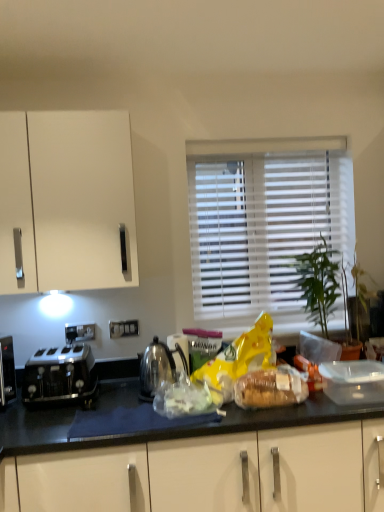
Measure the distance between polished metallic kettle at center and camera.

The depth of polished metallic kettle at center is 5.68 feet.

What is the approximate width of translucent plastic bag at center, positioned as the first food in left-to-right order?

It is 8.03 inches.

What do you see at coordinates (59, 375) in the screenshot? The image size is (384, 512). I see `satin black toaster at left` at bounding box center [59, 375].

Identify the location of translucent plastic bread at center, which appears as the 2th food when viewed from the left. This screenshot has height=512, width=384. (270, 388).

What are the coordinates of `white blinds at center` in the screenshot? It's located at (263, 221).

Where is `polished metallic kettle at center`? polished metallic kettle at center is located at coordinates (158, 367).

Is satin black toaster at left surrounded by translucent plastic bag at center, the 2th food from the right?

Definitely not — satin black toaster at left is not inside translucent plastic bag at center, the 2th food from the right.

How much distance is there between translucent plastic bag at center, the 2th food from the right, and satin black toaster at left?

translucent plastic bag at center, the 2th food from the right, and satin black toaster at left are 16.89 inches apart.

Consider the image. Looking at their sizes, would you say translucent plastic bag at center, positioned as the first food in left-to-right order, is wider or thinner than satin black toaster at left?

translucent plastic bag at center, positioned as the first food in left-to-right order, is thinner than satin black toaster at left.

Can you see translucent plastic bag at center, the 2th food from the right, touching satin black toaster at left?

No, translucent plastic bag at center, the 2th food from the right, is not next to satin black toaster at left.

Is polished metallic kettle at center oriented towards white blinds at center?

No, polished metallic kettle at center is not oriented towards white blinds at center.

In the image, is polished metallic kettle at center positioned in front of or behind white blinds at center?

In the image, polished metallic kettle at center appears in front of white blinds at center.

Is point (170, 355) closer or farther from the camera than point (202, 256)?

Clearly, point (170, 355) is closer to the camera than point (202, 256).

How far apart are polished metallic kettle at center and white blinds at center?

The distance of polished metallic kettle at center from white blinds at center is 29.71 inches.

Is satin black toaster at left further to the viewer compared to white blinds at center?

No.

Is white blinds at center surrounded by satin black toaster at left?

No, satin black toaster at left does not contain white blinds at center.

Is satin black toaster at left oriented away from white blinds at center?

No, satin black toaster at left is not facing away from white blinds at center.

Relative to white blinds at center, is translucent plastic bread at center, which appears as the 2th food when viewed from the left, in front or behind?

Clearly, translucent plastic bread at center, which appears as the 2th food when viewed from the left, is in front of white blinds at center.

Is translucent plastic bread at center, which appears as the 2th food when viewed from the left, bigger than white blinds at center?

Actually, translucent plastic bread at center, which appears as the 2th food when viewed from the left, might be smaller than white blinds at center.

From their relative heights in the image, would you say translucent plastic bread at center, marked as the first food in a right-to-left arrangement, is taller or shorter than white blinds at center?

In the image, translucent plastic bread at center, marked as the first food in a right-to-left arrangement, appears to be shorter than white blinds at center.

Which is in front, point (235, 386) or point (245, 280)?

The point (235, 386) is more forward.

From a real-world perspective, between translucent plastic bread at center, which appears as the 2th food when viewed from the left, and translucent plastic bag at center, the 2th food from the right, who is vertically higher?

translucent plastic bread at center, which appears as the 2th food when viewed from the left, from a real-world perspective.

Considering the sizes of objects translucent plastic bread at center, marked as the first food in a right-to-left arrangement, and translucent plastic bag at center, positioned as the first food in left-to-right order, in the image provided, who is taller, translucent plastic bread at center, marked as the first food in a right-to-left arrangement, or translucent plastic bag at center, positioned as the first food in left-to-right order,?

With more height is translucent plastic bread at center, marked as the first food in a right-to-left arrangement.

Which of these two, translucent plastic bread at center, marked as the first food in a right-to-left arrangement, or translucent plastic bag at center, the 2th food from the right, is wider?

With larger width is translucent plastic bag at center, the 2th food from the right.

How different are the orientations of translucent plastic bread at center, marked as the first food in a right-to-left arrangement, and translucent plastic bag at center, the 2th food from the right, in degrees?

They differ by 11.7 degrees in their facing directions.

Between white blinds at center and polished metallic kettle at center, which one appears on the left side from the viewer's perspective?

Positioned to the left is polished metallic kettle at center.

Does white blinds at center have a smaller size compared to polished metallic kettle at center?

Incorrect, white blinds at center is not smaller in size than polished metallic kettle at center.

Is white blinds at center facing towards polished metallic kettle at center?

No, white blinds at center does not turn towards polished metallic kettle at center.

From the image's perspective, between white blinds at center and polished metallic kettle at center, which one is located above?

From the image's view, white blinds at center is above.

Considering the positions of points (193, 263) and (250, 396), is point (193, 263) farther from camera compared to point (250, 396)?

Yes, point (193, 263) is farther from viewer.

Is white blinds at center shorter than translucent plastic bread at center, marked as the first food in a right-to-left arrangement?

Incorrect, the height of white blinds at center does not fall short of that of translucent plastic bread at center, marked as the first food in a right-to-left arrangement.

Is white blinds at center aimed at translucent plastic bread at center, marked as the first food in a right-to-left arrangement?

Yes, white blinds at center is oriented towards translucent plastic bread at center, marked as the first food in a right-to-left arrangement.

Does white blinds at center contain translucent plastic bread at center, which appears as the 2th food when viewed from the left?

No, translucent plastic bread at center, which appears as the 2th food when viewed from the left, is located outside of white blinds at center.

From a real-world perspective, which food is the 2nd one underneath the satin black toaster at left? Please provide its 2D coordinates.

[(182, 398)]

Find the location of `kettle on the left of the white blinds at center`. kettle on the left of the white blinds at center is located at coordinates (158, 367).

Looking at the image, which one is located further to polished metallic kettle at center, translucent plastic bread at center, marked as the first food in a right-to-left arrangement, or white blinds at center?

Among the two, white blinds at center is located further to polished metallic kettle at center.

From the image, which object appears to be nearer to translucent plastic bag at center, positioned as the first food in left-to-right order, polished metallic kettle at center or translucent plastic bread at center, marked as the first food in a right-to-left arrangement?

polished metallic kettle at center is positioned closer to the anchor translucent plastic bag at center, positioned as the first food in left-to-right order.

When comparing their distances from satin black toaster at left, does translucent plastic bag at center, positioned as the first food in left-to-right order, or polished metallic kettle at center seem further?

Among the two, translucent plastic bag at center, positioned as the first food in left-to-right order, is located further to satin black toaster at left.

Looking at the image, which one is located further to translucent plastic bread at center, marked as the first food in a right-to-left arrangement, satin black toaster at left or polished metallic kettle at center?

Based on the image, satin black toaster at left appears to be further to translucent plastic bread at center, marked as the first food in a right-to-left arrangement.

From the picture: Estimate the real-world distances between objects in this image. Which object is further from polished metallic kettle at center, satin black toaster at left or white blinds at center?

The object further to polished metallic kettle at center is white blinds at center.

Estimate the real-world distances between objects in this image. Which object is further from satin black toaster at left, polished metallic kettle at center or white blinds at center?

Based on the image, white blinds at center appears to be further to satin black toaster at left.

Estimate the real-world distances between objects in this image. Which object is further from translucent plastic bread at center, which appears as the 2th food when viewed from the left, translucent plastic bag at center, positioned as the first food in left-to-right order, or polished metallic kettle at center?

polished metallic kettle at center is further to translucent plastic bread at center, which appears as the 2th food when viewed from the left.

When comparing their distances from white blinds at center, does translucent plastic bag at center, the 2th food from the right, or polished metallic kettle at center seem closer?

polished metallic kettle at center.

The image size is (384, 512). What are the coordinates of `kettle between satin black toaster at left and translucent plastic bread at center, which appears as the 2th food when viewed from the left` in the screenshot? It's located at [x=158, y=367].

Locate an element on the screen. The height and width of the screenshot is (512, 384). food between white blinds at center and translucent plastic bag at center, the 2th food from the right, from top to bottom is located at coordinates (270, 388).

The width and height of the screenshot is (384, 512). I want to click on food situated between polished metallic kettle at center and translucent plastic bread at center, marked as the first food in a right-to-left arrangement, from left to right, so click(182, 398).

The width and height of the screenshot is (384, 512). Identify the location of kettle located between satin black toaster at left and white blinds at center in the left-right direction. (158, 367).